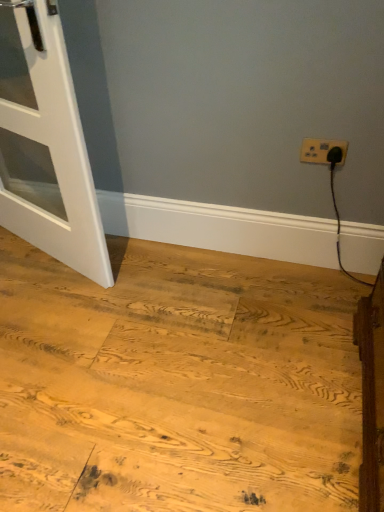
I want to click on vacant space underneath white matte door at left (from a real-world perspective), so click(48, 256).